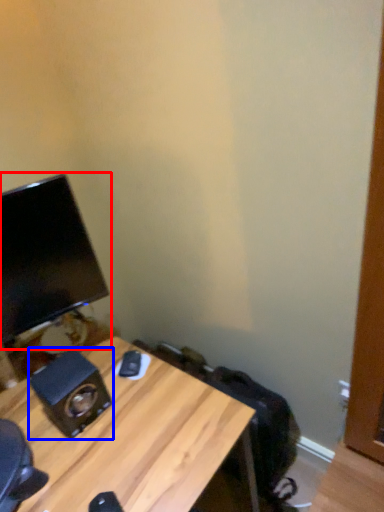
Question: Which of the following is the farthest to the observer, computer monitor (highlighted by a red box) or speaker (highlighted by a blue box)?

Choices:
 (A) computer monitor
 (B) speaker

Answer: (B)